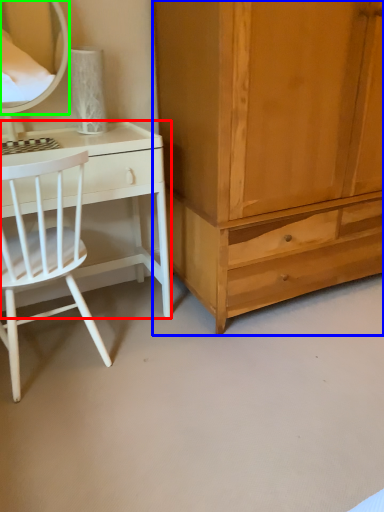
Question: Estimate the real-world distances between objects in this image. Which object is closer to desk (highlighted by a red box), cabinetry (highlighted by a blue box) or mirror (highlighted by a green box)?

Choices:
 (A) cabinetry
 (B) mirror

Answer: (A)